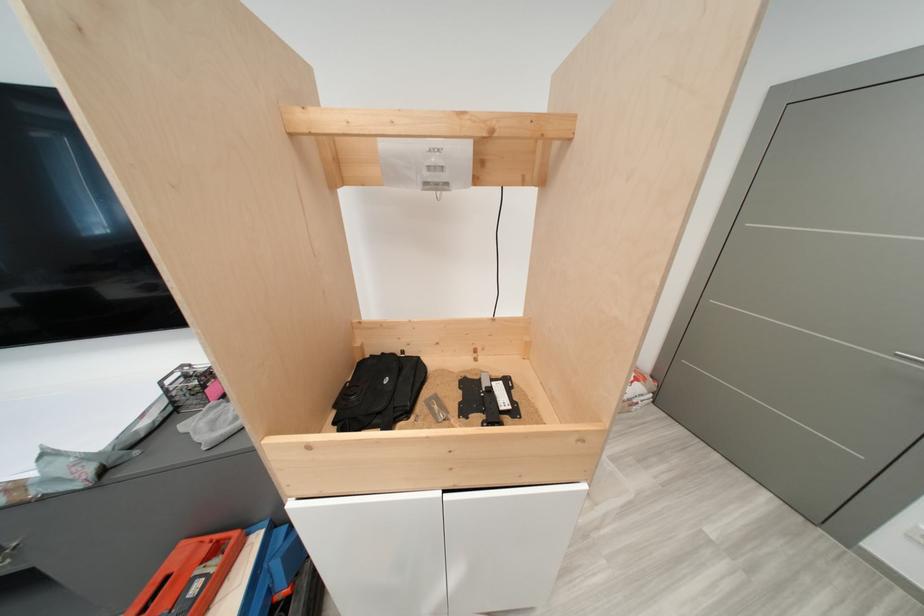
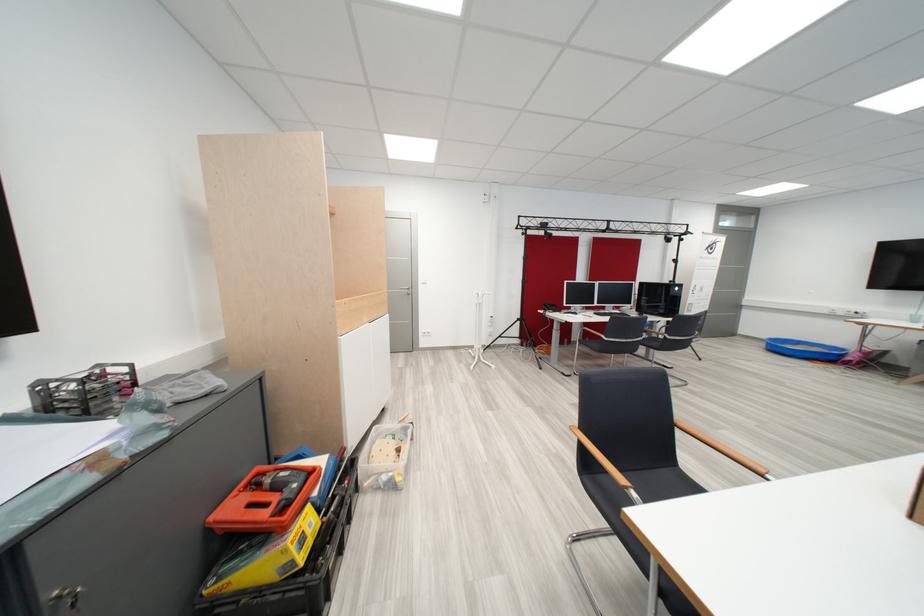
In the second image, find the point that corresponds to point 455,493 in the first image.

(379, 326)